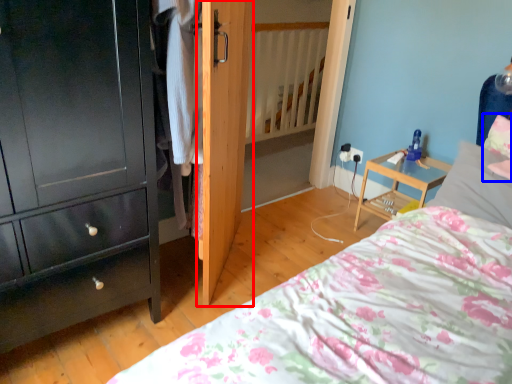
Question: Which of the following is the closest to the observer, door (highlighted by a red box) or pillow (highlighted by a blue box)?

Choices:
 (A) door
 (B) pillow

Answer: (A)